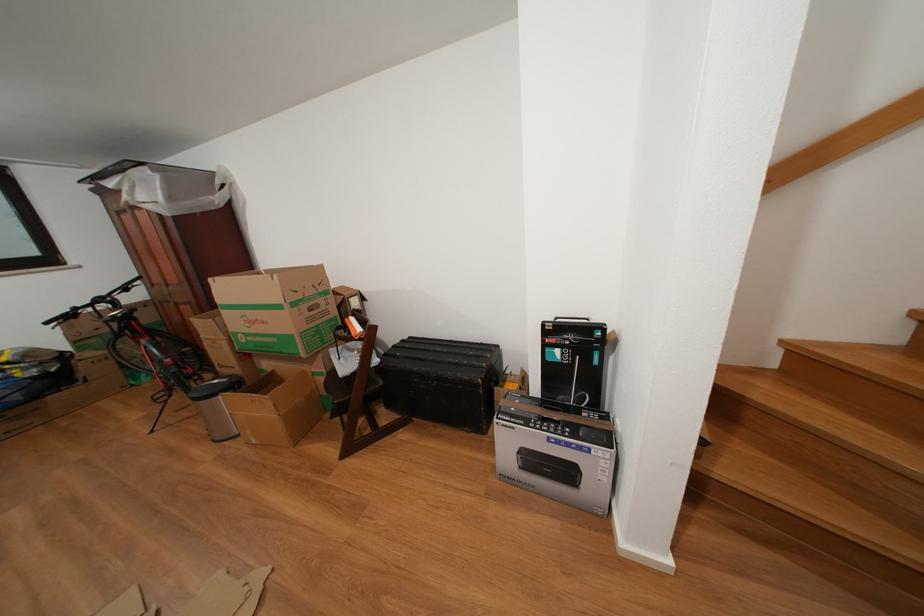
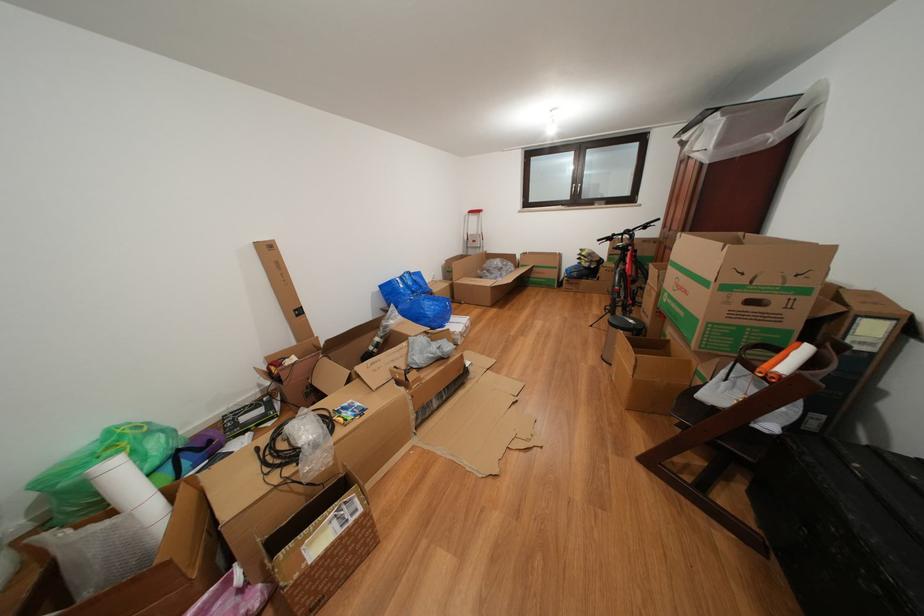
Find the pixel in the second image that matches pixel 272 328 in the first image.

(694, 297)